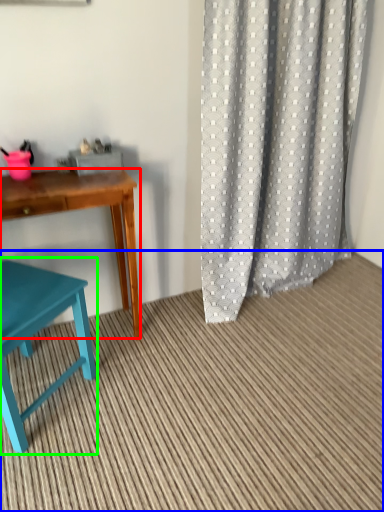
Question: Based on their relative distances, which object is farther from desk (highlighted by a red box)? Choose from plain (highlighted by a blue box) and chair (highlighted by a green box).

Choices:
 (A) plain
 (B) chair

Answer: (A)